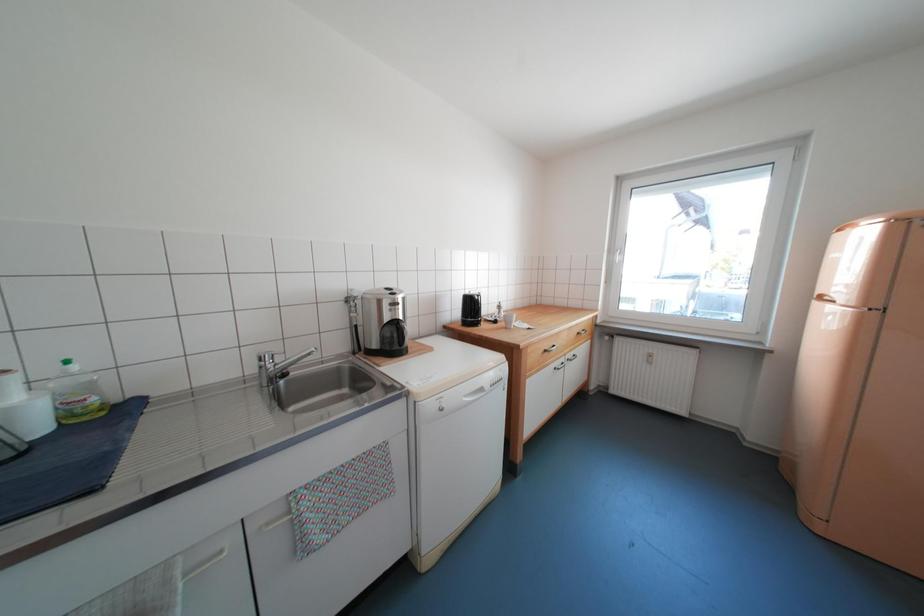
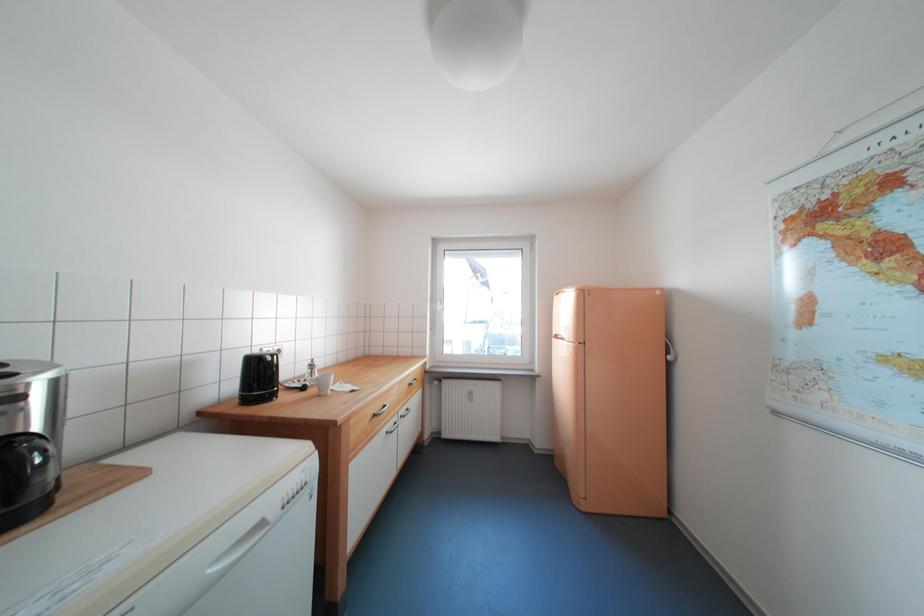
Question: The camera is either moving clockwise (left) or counter-clockwise (right) around the object. The first image is from the beginning of the video and the second image is from the end. Is the camera moving left or right when shooting the video?

Choices:
 (A) Left
 (B) Right

Answer: (A)